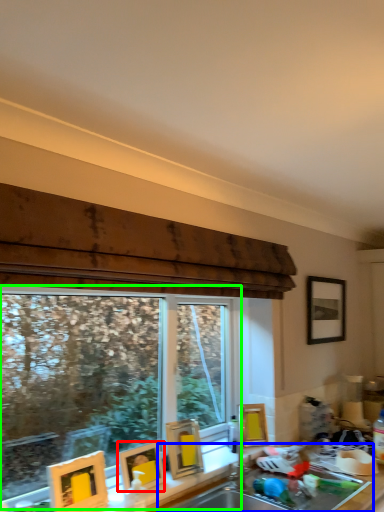
Question: Which is farther away from picture frame (highlighted by a red box)? sink (highlighted by a blue box) or window (highlighted by a green box)?

Choices:
 (A) sink
 (B) window

Answer: (B)